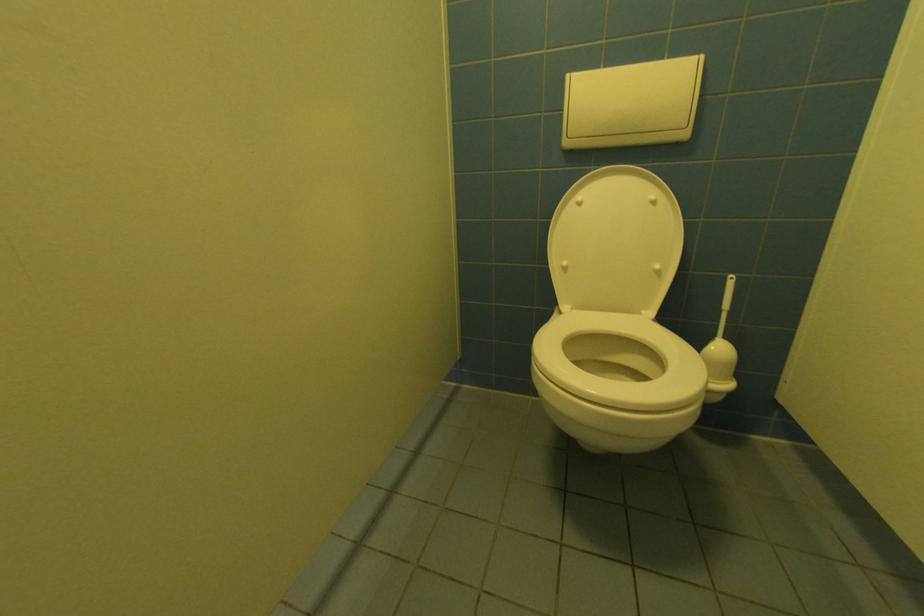
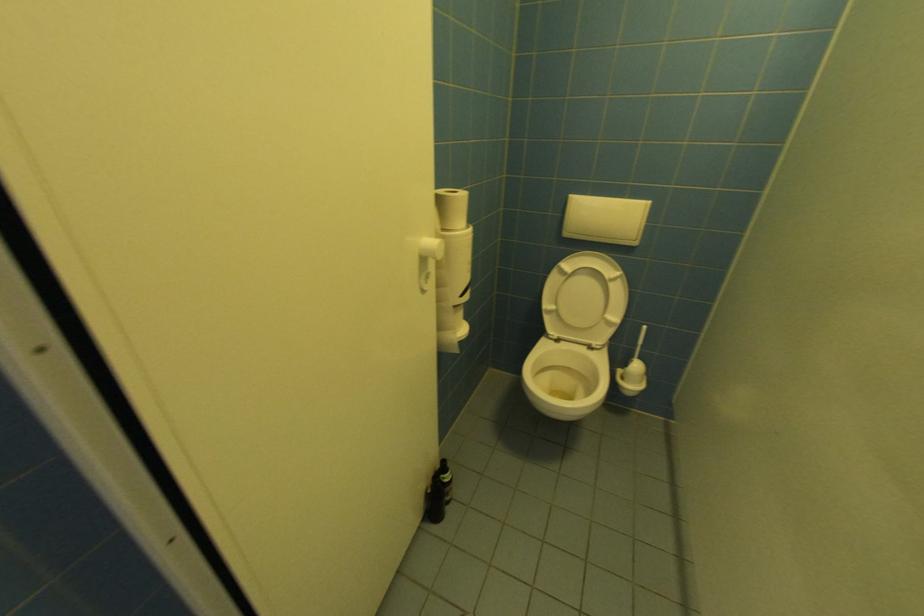
Question: Which direction would the cameraman need to move to produce the second image? Reply with the corresponding letter.

Choices:
 (A) Left
 (B) Right
 (C) Forward
 (D) Backward

Answer: (A)